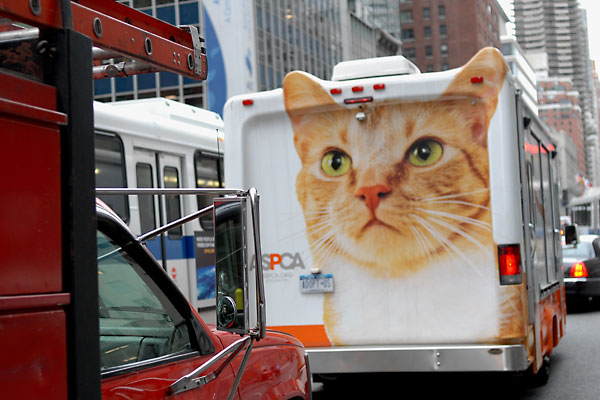
Where is `back lights`? back lights is located at coordinates (584, 270), (506, 263).